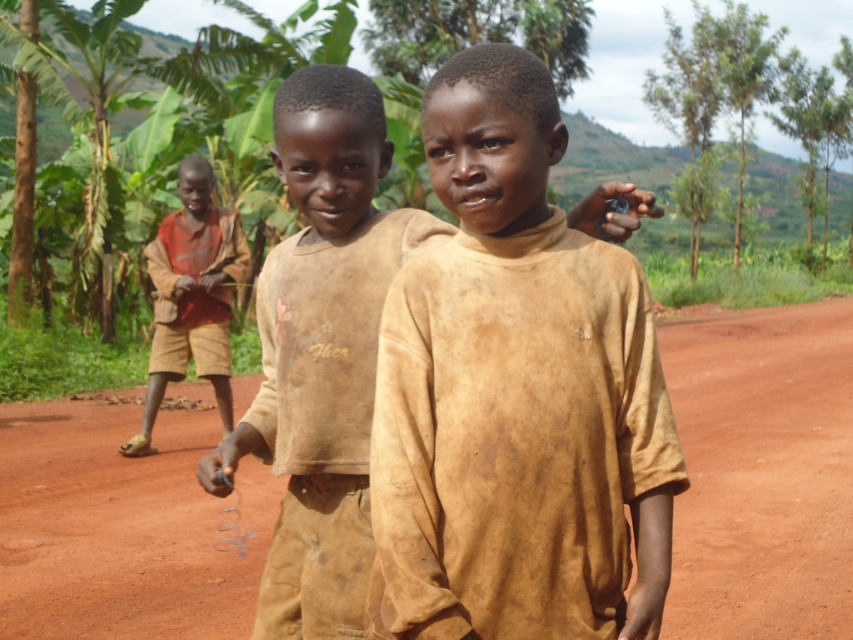
Measure the distance between point (724, 568) and camera.

Point (724, 568) and camera are 5.09 meters apart from each other.

Is brown dirt track at center thinner than brown cotton shirt at center?

In fact, brown dirt track at center might be wider than brown cotton shirt at center.

The image size is (853, 640). I want to click on brown dirt track at center, so click(x=762, y=470).

Does point (465, 339) come farther from viewer compared to point (712, 538)?

That is False.

Does brown matte shirt at center lie in front of brown dirt track at center?

Yes.

Where is `brown matte shirt at center`? This screenshot has width=853, height=640. brown matte shirt at center is located at coordinates (515, 394).

Does brown matte shirt at center have a lesser height compared to brown cotton shirt at center?

Yes.

Looking at this image, does brown matte shirt at center appear on the right side of brown cotton shirt at center?

Indeed, brown matte shirt at center is positioned on the right side of brown cotton shirt at center.

You are a GUI agent. You are given a task and a screenshot of the screen. Output one action in this format:
    pyautogui.click(x=<x>, y=<y>)
    Task: Click on the brown matte shirt at center
    
    Given the screenshot: What is the action you would take?
    pyautogui.click(x=515, y=394)

Where is `brown matte shirt at center`? This screenshot has width=853, height=640. brown matte shirt at center is located at coordinates click(515, 394).